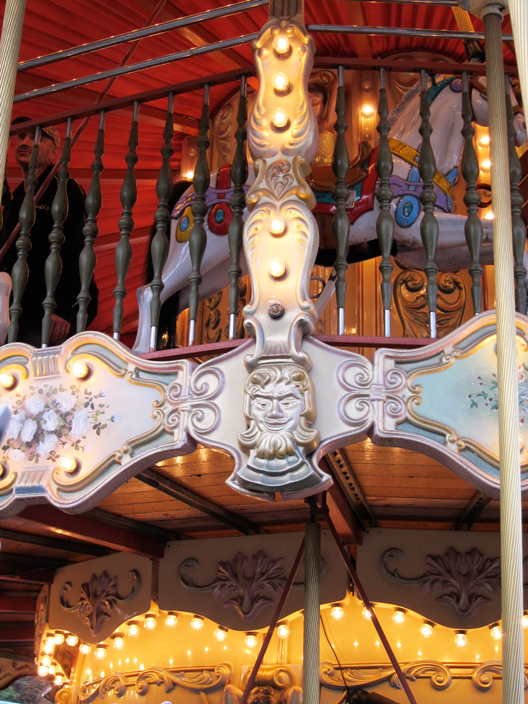
Locate an element on the screen. The width and height of the screenshot is (528, 704). the top floor wall is located at coordinates (110, 196).